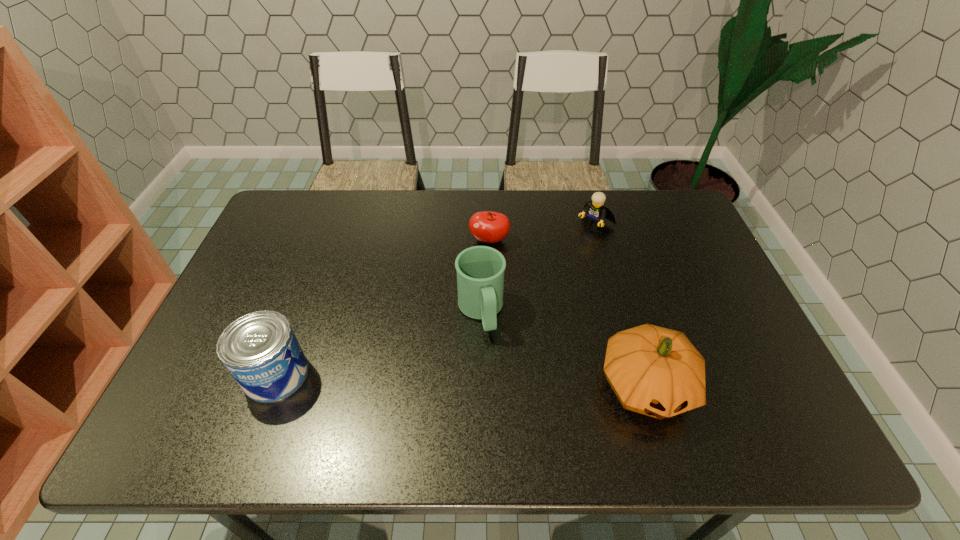
You are a GUI agent. You are given a task and a screenshot of the screen. Output one action in this format:
    pyautogui.click(x=<x>, y=<y>)
    Task: Click on the vacant space at the far left corner of the desktop
    The width and height of the screenshot is (960, 540).
    Given the screenshot: What is the action you would take?
    pyautogui.click(x=310, y=216)

Where is `free space at the near left corner of the desktop`? The image size is (960, 540). free space at the near left corner of the desktop is located at coordinates click(x=210, y=382).

At what (x,y) coordinates should I click in order to perform the action: click on vacant space at the near right corner of the desktop. Please return your answer as a coordinate pair (x, y). This screenshot has height=540, width=960. Looking at the image, I should click on (725, 393).

Identify the location of blank region between the mug and the gourd. Image resolution: width=960 pixels, height=540 pixels. (564, 349).

You are a GUI agent. You are given a task and a screenshot of the screen. Output one action in this format:
    pyautogui.click(x=<x>, y=<y>)
    Task: Click on the free space between the Lego and the gourd
    
    Given the screenshot: What is the action you would take?
    pyautogui.click(x=621, y=305)

Locate an element on the screen. vacant area between the gourd and the apple is located at coordinates (567, 313).

The width and height of the screenshot is (960, 540). What are the coordinates of `unoccupied area between the apple and the gourd` in the screenshot? It's located at (567, 313).

Locate an element on the screen. free space between the can and the gourd is located at coordinates (461, 380).

Image resolution: width=960 pixels, height=540 pixels. Find the location of `unoccupied area between the apple and the can`. unoccupied area between the apple and the can is located at coordinates (383, 308).

The image size is (960, 540). Identify the location of vacant space that's between the apple and the Lego. (542, 232).